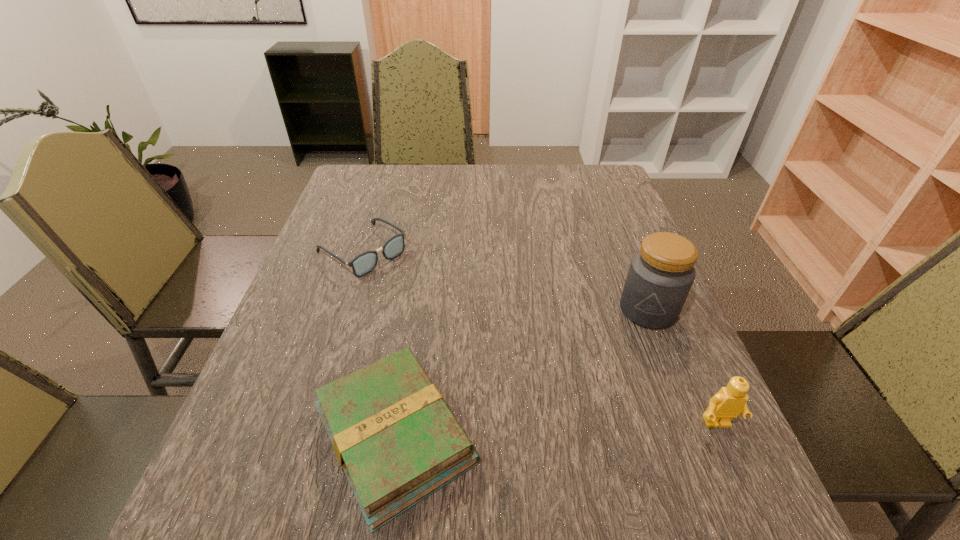
Identify the location of free spot on the desktop that is between the book and the second tallest object and is positioned on the face of the farthest object. (589, 429).

Find the location of a particular element. The image size is (960, 540). vacant space on the desktop that is between the book and the Lego and is positioned on the surface of the tallest object near the warning symbol is located at coordinates (596, 428).